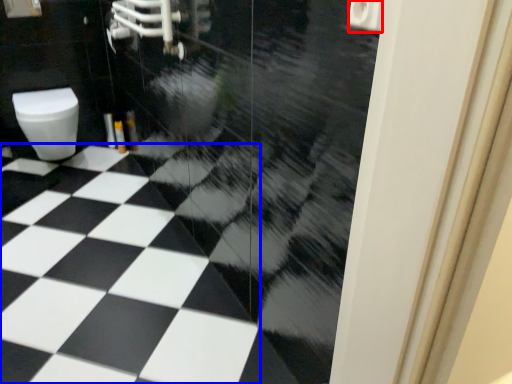
Question: Among these objects, which one is farthest to the camera, toilet paper (highlighted by a red box) or tile (highlighted by a blue box)?

Choices:
 (A) toilet paper
 (B) tile

Answer: (B)